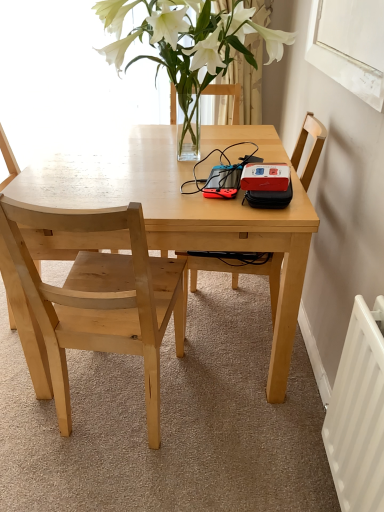
Question: Is light wood chair at left, positioned as the 2th chair in left-to-right order, wider or thinner than natural wood chair at left, which is counted as the 1th chair, starting from the left?

Choices:
 (A) wide
 (B) thin

Answer: (A)

Question: Is light wood chair at left, positioned as the 2th chair in left-to-right order, to the left or to the right of natural wood chair at left, which appears as the third chair when viewed from the right, in the image?

Choices:
 (A) left
 (B) right

Answer: (B)

Question: Estimate the real-world distances between objects in this image. Which object is closer to the translucent glass vase at upper center?

Choices:
 (A) natural wood chair at left, which appears as the third chair when viewed from the right
 (B) light wood table at center
 (C) wooden chair at center, the 3th chair in the left-to-right sequence
 (D) white metal radiator at lower right
 (E) white matte window screen at upper right

Answer: (B)

Question: Which object is positioned farthest from the light wood table at center?

Choices:
 (A) light wood chair at left, the 2th chair viewed from the right
 (B) wooden chair at center, the 3th chair in the left-to-right sequence
 (C) natural wood chair at left, which is counted as the 1th chair, starting from the left
 (D) translucent glass vase at upper center
 (E) white metal radiator at lower right

Answer: (E)